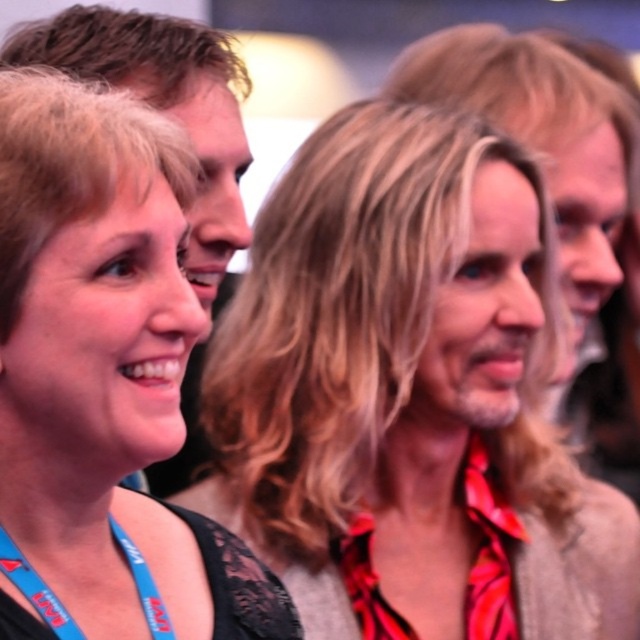
Question: Among these points, which one is farthest from the camera?

Choices:
 (A) (397, 474)
 (B) (17, 333)
 (C) (216, 512)

Answer: (A)

Question: Which point is closer to the camera?

Choices:
 (A) (13, 257)
 (B) (324, 163)
 (C) (420, 516)
 (D) (19, 468)

Answer: (A)

Question: Does matte black shirt at center appear on the left side of matte black lanyard at left?

Choices:
 (A) yes
 (B) no

Answer: (B)

Question: From the image, what is the correct spatial relationship of matte black lanyard at left in relation to matte black neck at lower left?

Choices:
 (A) right
 (B) left

Answer: (B)

Question: Which of the following is the farthest from the observer?

Choices:
 (A) (500, 380)
 (B) (420, 420)
 (C) (154, 396)
 (D) (104, 433)

Answer: (B)

Question: Can you confirm if matte black lanyard at left is thinner than matte black neck at lower left?

Choices:
 (A) yes
 (B) no

Answer: (B)